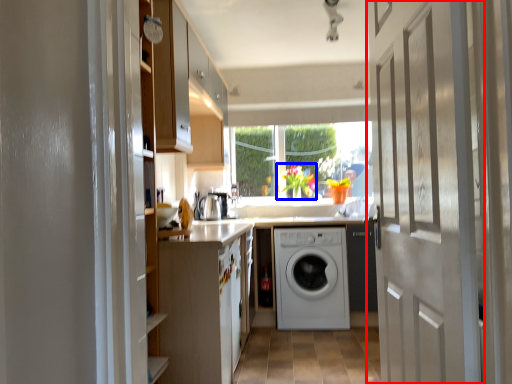
Question: Which of the following is the farthest to the observer, door (highlighted by a red box) or floral arrangement (highlighted by a blue box)?

Choices:
 (A) door
 (B) floral arrangement

Answer: (B)